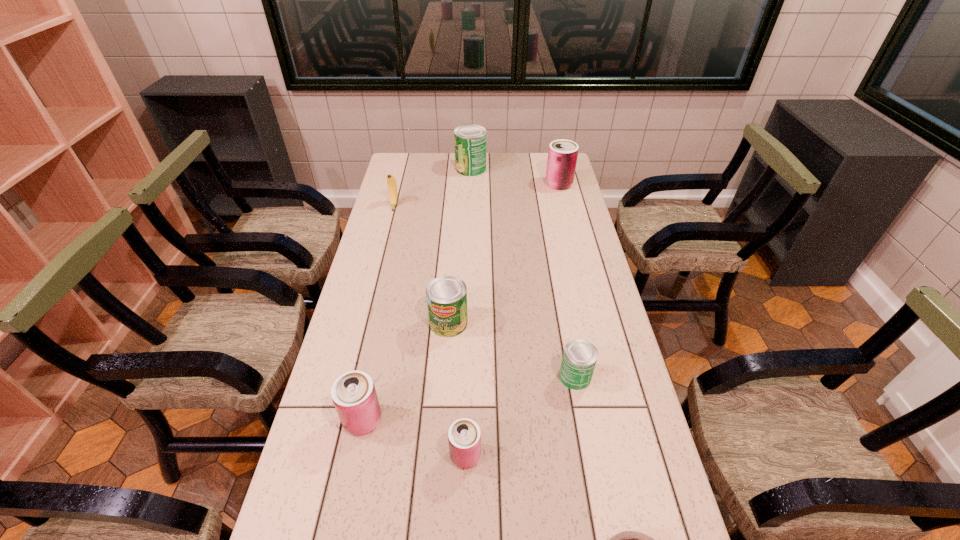
Where is `the biggest green can`? This screenshot has width=960, height=540. the biggest green can is located at coordinates (470, 140).

Locate an element on the screen. the farthest can is located at coordinates (470, 140).

Image resolution: width=960 pixels, height=540 pixels. In order to click on the farthest pink can in this screenshot , I will do `click(562, 155)`.

This screenshot has width=960, height=540. Find the location of `the second farthest object`. the second farthest object is located at coordinates (562, 155).

Image resolution: width=960 pixels, height=540 pixels. I want to click on the sixth nearest object, so click(x=391, y=181).

Where is `the fifth farthest can`? Image resolution: width=960 pixels, height=540 pixels. the fifth farthest can is located at coordinates point(353,393).

You are a GUI agent. You are given a task and a screenshot of the screen. Output one action in this format:
    pyautogui.click(x=<x>, y=<y>)
    Task: Click on the sixth farthest object
    The height and width of the screenshot is (540, 960).
    Given the screenshot: What is the action you would take?
    pyautogui.click(x=353, y=393)

At what (x,y) coordinates should I click in order to perform the action: click on the second biggest green can. Please return your answer as a coordinate pair (x, y). Looking at the image, I should click on (446, 296).

In order to click on the second farthest green can in this screenshot , I will do [446, 296].

This screenshot has height=540, width=960. What are the coordinates of `the fifth farthest object` in the screenshot? It's located at (579, 358).